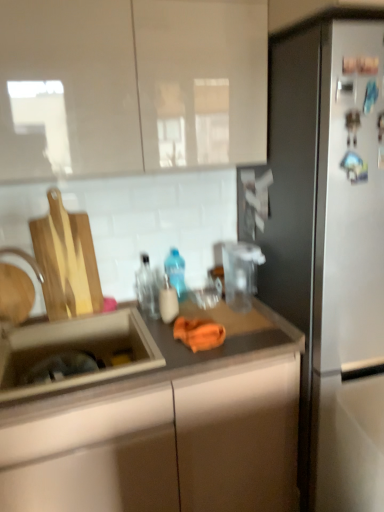
Identify the location of vacant space in front of matte plastic soap dispenser at center, marked as the first bottle in a front-to-back arrangement. Image resolution: width=384 pixels, height=512 pixels. (160, 334).